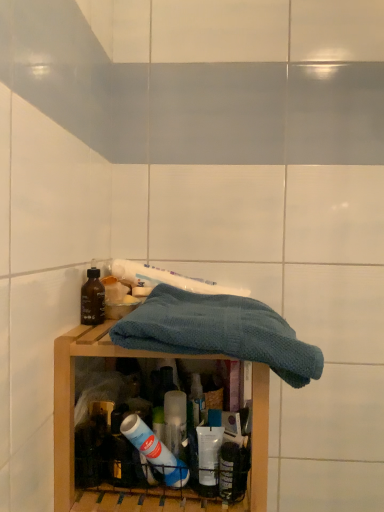
Question: Is wooden shelf at center further to camera compared to matte brown bottle at left?

Choices:
 (A) no
 (B) yes

Answer: (A)

Question: Could you tell me if wooden shelf at center is turned towards matte brown bottle at left?

Choices:
 (A) yes
 (B) no

Answer: (B)

Question: Considering the relative sizes of wooden shelf at center and matte brown bottle at left in the image provided, is wooden shelf at center smaller than matte brown bottle at left?

Choices:
 (A) yes
 (B) no

Answer: (B)

Question: Can you confirm if wooden shelf at center is thinner than matte brown bottle at left?

Choices:
 (A) yes
 (B) no

Answer: (B)

Question: Is wooden shelf at center wider than matte brown bottle at left?

Choices:
 (A) yes
 (B) no

Answer: (A)

Question: Is point (130, 262) closer or farther from the camera than point (91, 281)?

Choices:
 (A) closer
 (B) farther

Answer: (B)

Question: Which is correct: white glossy toothpaste at center is inside matte brown bottle at left, or outside of it?

Choices:
 (A) outside
 (B) inside

Answer: (A)

Question: Relative to matte brown bottle at left, is white glossy toothpaste at center in front or behind?

Choices:
 (A) behind
 (B) front

Answer: (A)

Question: Is white glossy toothpaste at center to the left or to the right of matte brown bottle at left in the image?

Choices:
 (A) left
 (B) right

Answer: (B)

Question: Is point (145, 331) closer or farther from the camera than point (102, 294)?

Choices:
 (A) closer
 (B) farther

Answer: (A)

Question: From a real-world perspective, is blue knitted towel at center positioned above or below matte brown bottle at left?

Choices:
 (A) above
 (B) below

Answer: (B)

Question: Is blue knitted towel at center bigger or smaller than matte brown bottle at left?

Choices:
 (A) small
 (B) big

Answer: (B)

Question: Considering their positions, is blue knitted towel at center located in front of or behind matte brown bottle at left?

Choices:
 (A) behind
 (B) front

Answer: (B)

Question: Looking at their shapes, would you say wooden shelf at center is wider or thinner than blue knitted towel at center?

Choices:
 (A) thin
 (B) wide

Answer: (B)

Question: From the image's perspective, is wooden shelf at center positioned above or below blue knitted towel at center?

Choices:
 (A) above
 (B) below

Answer: (B)